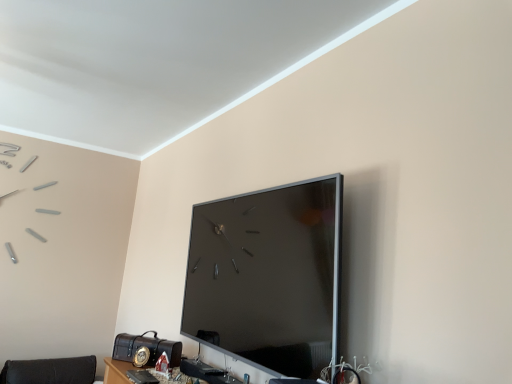
Measure the distance between black leather alarm clock at lower center and camera.

black leather alarm clock at lower center is 1.99 meters from camera.

The height and width of the screenshot is (384, 512). What do you see at coordinates (147, 347) in the screenshot? I see `black leather alarm clock at lower center` at bounding box center [147, 347].

At what (x,y) coordinates should I click in order to perform the action: click on black leather alarm clock at lower center. Please return your answer as a coordinate pair (x, y). Image resolution: width=512 pixels, height=384 pixels. Looking at the image, I should click on (147, 347).

Where is `black leather alarm clock at lower center`? The width and height of the screenshot is (512, 384). black leather alarm clock at lower center is located at coordinates (147, 347).